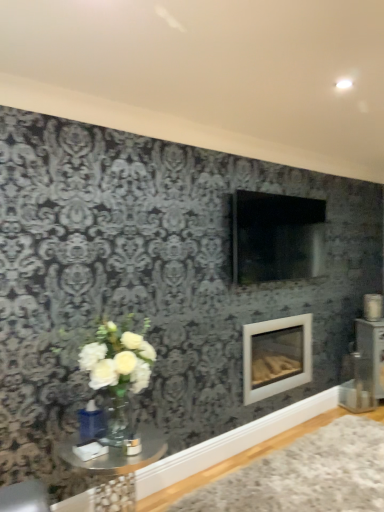
Question: Is clear glass table at lower left in contact with white plush rug at lower right?

Choices:
 (A) yes
 (B) no

Answer: (B)

Question: From a real-world perspective, is clear glass table at lower left on white plush rug at lower right?

Choices:
 (A) no
 (B) yes

Answer: (B)

Question: Can you confirm if clear glass table at lower left is wider than white plush rug at lower right?

Choices:
 (A) yes
 (B) no

Answer: (B)

Question: Is clear glass table at lower left taller than white plush rug at lower right?

Choices:
 (A) yes
 (B) no

Answer: (A)

Question: Is clear glass table at lower left completely or partially outside of white plush rug at lower right?

Choices:
 (A) no
 (B) yes

Answer: (B)

Question: Is clear glass table at lower left positioned with its back to white plush rug at lower right?

Choices:
 (A) yes
 (B) no

Answer: (B)

Question: Is white plush rug at lower right smaller than clear glass table at lower left?

Choices:
 (A) no
 (B) yes

Answer: (B)

Question: Are white plush rug at lower right and clear glass table at lower left far apart?

Choices:
 (A) yes
 (B) no

Answer: (B)

Question: Can you see white plush rug at lower right touching clear glass table at lower left?

Choices:
 (A) no
 (B) yes

Answer: (A)

Question: Could you tell me if white plush rug at lower right is turned towards clear glass table at lower left?

Choices:
 (A) yes
 (B) no

Answer: (B)

Question: From a real-world perspective, is white plush rug at lower right over clear glass table at lower left?

Choices:
 (A) yes
 (B) no

Answer: (B)

Question: Does white plush rug at lower right have a greater height compared to clear glass table at lower left?

Choices:
 (A) no
 (B) yes

Answer: (A)

Question: Considering the relative sizes of white glossy fireplace at center and clear glass table at lower left in the image provided, is white glossy fireplace at center thinner than clear glass table at lower left?

Choices:
 (A) no
 (B) yes

Answer: (B)